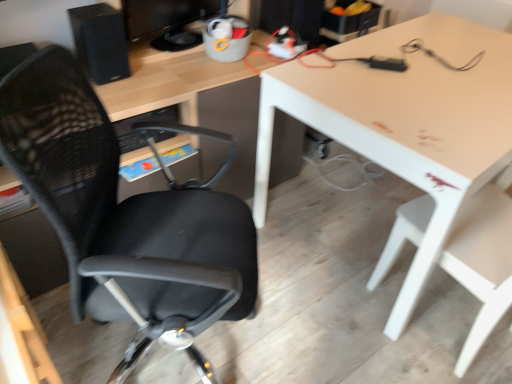
This screenshot has height=384, width=512. I want to click on black matte speaker at upper left, so click(100, 42).

Find the location of a particular element. This screenshot has height=384, width=512. white plastic chair at lower right, which appears as the 1th chair when viewed from the right is located at coordinates click(482, 259).

Describe the element at coordinates (167, 21) in the screenshot. I see `matte black monitor at upper center` at that location.

The height and width of the screenshot is (384, 512). What do you see at coordinates (420, 153) in the screenshot? I see `white glossy table at upper right` at bounding box center [420, 153].

Where is `black matte speaker at upper left`? black matte speaker at upper left is located at coordinates (100, 42).

Is point (159, 38) more distant than point (84, 42)?

That is True.

Which is more to the left, matte black monitor at upper center or black matte speaker at upper left?

black matte speaker at upper left is more to the left.

Between matte black monitor at upper center and black matte speaker at upper left, which one has smaller width?

Thinner between the two is matte black monitor at upper center.

How distant is matte black monitor at upper center from black matte speaker at upper left?

They are 7.18 inches apart.

Is black mesh office chair at left, the 2th chair when ordered from right to left, looking in the opposite direction of white glossy table at upper right?

No.

In the scene shown: Are black mesh office chair at left, the 2th chair when ordered from right to left, and white glossy table at upper right located far from each other?

They are positioned close to each other.

From a real-world perspective, is black mesh office chair at left, the first chair viewed from the left, under white glossy table at upper right?

No, from a real-world perspective, black mesh office chair at left, the first chair viewed from the left, is not under white glossy table at upper right.

Which of these two, black mesh office chair at left, the 2th chair when ordered from right to left, or white glossy table at upper right, is thinner?

black mesh office chair at left, the 2th chair when ordered from right to left, is thinner.

From a real-world perspective, does black mesh office chair at left, the 2th chair when ordered from right to left, sit lower than matte black monitor at upper center?

Yes, from a real-world perspective, black mesh office chair at left, the 2th chair when ordered from right to left, is under matte black monitor at upper center.

Would you say black mesh office chair at left, the 2th chair when ordered from right to left, is inside or outside matte black monitor at upper center?

black mesh office chair at left, the 2th chair when ordered from right to left, lies outside matte black monitor at upper center.

Does black mesh office chair at left, the first chair viewed from the left, come behind matte black monitor at upper center?

No, black mesh office chair at left, the first chair viewed from the left, is in front of matte black monitor at upper center.

Is black mesh office chair at left, the 2th chair when ordered from right to left, taller or shorter than matte black monitor at upper center?

Clearly, black mesh office chair at left, the 2th chair when ordered from right to left, is taller compared to matte black monitor at upper center.

Is black mesh office chair at left, the 2th chair when ordered from right to left, in front of or behind white plastic chair at lower right, which appears as the 1th chair when viewed from the right, in the image?

black mesh office chair at left, the 2th chair when ordered from right to left, is positioned closer to the viewer than white plastic chair at lower right, which appears as the 1th chair when viewed from the right.

From the picture: Can you confirm if black mesh office chair at left, the 2th chair when ordered from right to left, is positioned to the left of white plastic chair at lower right, the second chair positioned from the left?

Yes.

Which of these two, black mesh office chair at left, the 2th chair when ordered from right to left, or white plastic chair at lower right, which appears as the 1th chair when viewed from the right, stands taller?

With more height is black mesh office chair at left, the 2th chair when ordered from right to left.

Considering the positions of points (71, 56) and (489, 264), is point (71, 56) closer to camera compared to point (489, 264)?

Yes.

Is white plastic chair at lower right, which appears as the 1th chair when viewed from the right, outside of matte black monitor at upper center?

Yes, white plastic chair at lower right, which appears as the 1th chair when viewed from the right, is outside of matte black monitor at upper center.

Which is more to the left, white plastic chair at lower right, which appears as the 1th chair when viewed from the right, or matte black monitor at upper center?

matte black monitor at upper center.

Is white plastic chair at lower right, the second chair positioned from the left, facing away from matte black monitor at upper center?

white plastic chair at lower right, the second chair positioned from the left, does not have its back to matte black monitor at upper center.

You are a GUI agent. You are given a task and a screenshot of the screen. Output one action in this format:
    pyautogui.click(x=<x>, y=<y>)
    Task: Click on the table on the right of black mesh office chair at left, the first chair viewed from the left
    Image resolution: width=512 pixels, height=384 pixels.
    Given the screenshot: What is the action you would take?
    pyautogui.click(x=420, y=153)

Considering the relative sizes of white glossy table at upper right and black mesh office chair at left, the first chair viewed from the left, in the image provided, is white glossy table at upper right smaller than black mesh office chair at left, the first chair viewed from the left,?

Actually, white glossy table at upper right might be larger than black mesh office chair at left, the first chair viewed from the left.

Considering the positions of objects white glossy table at upper right and black mesh office chair at left, the first chair viewed from the left, in the image provided, who is in front, white glossy table at upper right or black mesh office chair at left, the first chair viewed from the left,?

black mesh office chair at left, the first chair viewed from the left, is in front.

Is white plastic chair at lower right, the second chair positioned from the left, facing towards black mesh office chair at left, the first chair viewed from the left?

No, white plastic chair at lower right, the second chair positioned from the left, is not facing towards black mesh office chair at left, the first chair viewed from the left.

Is white plastic chair at lower right, which appears as the 1th chair when viewed from the right, at the right side of black mesh office chair at left, the first chair viewed from the left?

Yes.

Can you confirm if white plastic chair at lower right, the second chair positioned from the left, is thinner than black mesh office chair at left, the 2th chair when ordered from right to left?

Yes.

How different are the orientations of white plastic chair at lower right, which appears as the 1th chair when viewed from the right, and black mesh office chair at left, the first chair viewed from the left, in degrees?

The angle between the facing direction of white plastic chair at lower right, which appears as the 1th chair when viewed from the right, and the facing direction of black mesh office chair at left, the first chair viewed from the left, is 119 degrees.

At what (x,y) coordinates should I click in order to perform the action: click on computer tower below the matte black monitor at upper center (from a real-world perspective). Please return your answer as a coordinate pair (x, y). Looking at the image, I should click on (100, 42).

In order to click on chair on the left of the white glossy table at upper right in this screenshot , I will do `click(126, 215)`.

Which object lies nearer to the anchor point white plastic chair at lower right, the second chair positioned from the left, matte black monitor at upper center or black matte speaker at upper left?

matte black monitor at upper center lies closer to white plastic chair at lower right, the second chair positioned from the left, than the other object.

From the image, which object appears to be farther from white plastic chair at lower right, which appears as the 1th chair when viewed from the right, black mesh office chair at left, the first chair viewed from the left, or matte black monitor at upper center?

matte black monitor at upper center lies further to white plastic chair at lower right, which appears as the 1th chair when viewed from the right, than the other object.

From the image, which object appears to be nearer to white glossy table at upper right, white plastic chair at lower right, the second chair positioned from the left, or matte black monitor at upper center?

white plastic chair at lower right, the second chair positioned from the left.

Estimate the real-world distances between objects in this image. Which object is closer to black matte speaker at upper left, white glossy table at upper right or matte black monitor at upper center?

Among the two, matte black monitor at upper center is located nearer to black matte speaker at upper left.

Based on their spatial positions, is black mesh office chair at left, the first chair viewed from the left, or black matte speaker at upper left closer to white glossy table at upper right?

black mesh office chair at left, the first chair viewed from the left, lies closer to white glossy table at upper right than the other object.

Based on their spatial positions, is matte black monitor at upper center or black mesh office chair at left, the 2th chair when ordered from right to left, further from white glossy table at upper right?

The object further to white glossy table at upper right is matte black monitor at upper center.

When comparing their distances from black matte speaker at upper left, does black mesh office chair at left, the 2th chair when ordered from right to left, or white plastic chair at lower right, which appears as the 1th chair when viewed from the right, seem closer?

The object closer to black matte speaker at upper left is black mesh office chair at left, the 2th chair when ordered from right to left.

Estimate the real-world distances between objects in this image. Which object is closer to black mesh office chair at left, the 2th chair when ordered from right to left, white plastic chair at lower right, which appears as the 1th chair when viewed from the right, or white glossy table at upper right?

white glossy table at upper right.

At what (x,y) coordinates should I click in order to perform the action: click on chair located between matte black monitor at upper center and white glossy table at upper right in the left-right direction. Please return your answer as a coordinate pair (x, y). The image size is (512, 384). Looking at the image, I should click on (126, 215).

This screenshot has width=512, height=384. In order to click on chair located between matte black monitor at upper center and white plastic chair at lower right, which appears as the 1th chair when viewed from the right, in the left-right direction in this screenshot , I will do `click(126, 215)`.

Locate an element on the screen. chair between black matte speaker at upper left and white glossy table at upper right in the horizontal direction is located at coordinates (126, 215).

Locate an element on the screen. The width and height of the screenshot is (512, 384). computer monitor between black matte speaker at upper left and white glossy table at upper right from left to right is located at coordinates (167, 21).